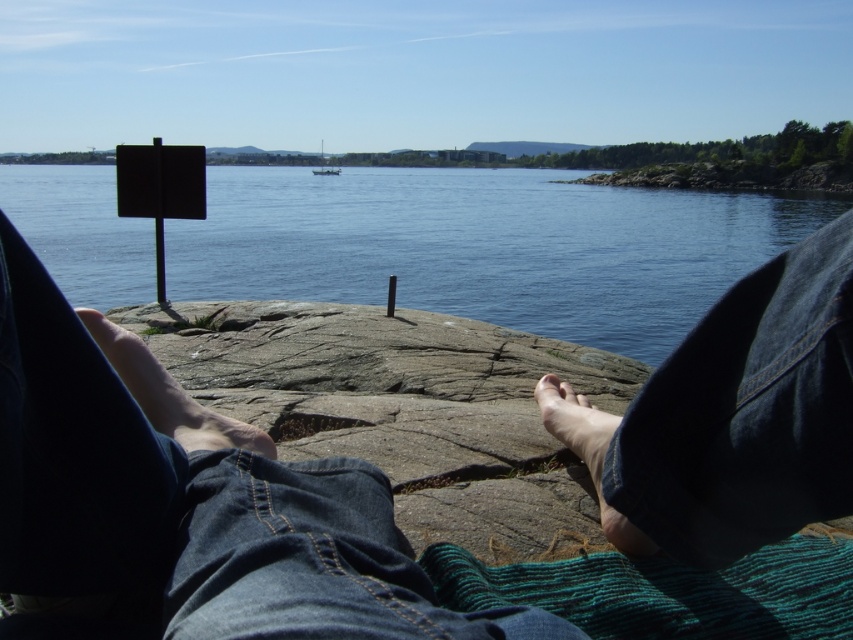
Question: Which object appears farthest from the camera in this image?

Choices:
 (A) smooth skin foot at lower right
 (B) matte skin toe at lower center

Answer: (B)

Question: Is smooth skin foot at lower right positioned behind white wooden boat at center?

Choices:
 (A) yes
 (B) no

Answer: (B)

Question: Which object is closer to the camera taking this photo?

Choices:
 (A) white wooden boat at center
 (B) smooth skin foot at lower right

Answer: (B)

Question: Is smooth skin foot at center below white wooden boat at center?

Choices:
 (A) yes
 (B) no

Answer: (A)

Question: Does gray rough rock at center appear over white plastic boat at center?

Choices:
 (A) no
 (B) yes

Answer: (A)

Question: Based on their relative distances, which object is nearer to the jeans at center?

Choices:
 (A) smooth skin foot at lower right
 (B) matte skin toe at lower center

Answer: (A)